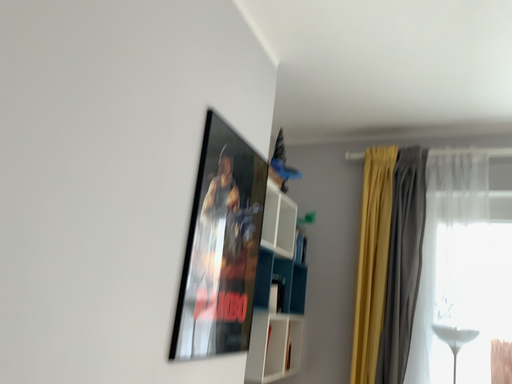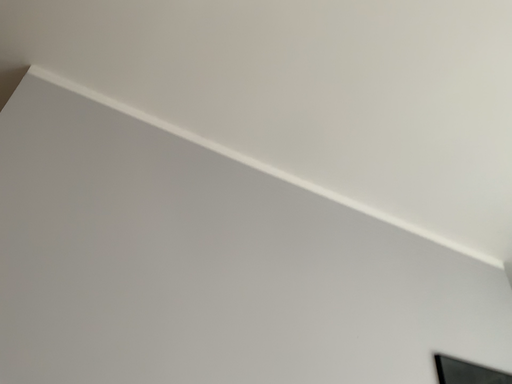
Question: How did the camera likely rotate when shooting the video?

Choices:
 (A) rotated downward
 (B) rotated upward

Answer: (B)